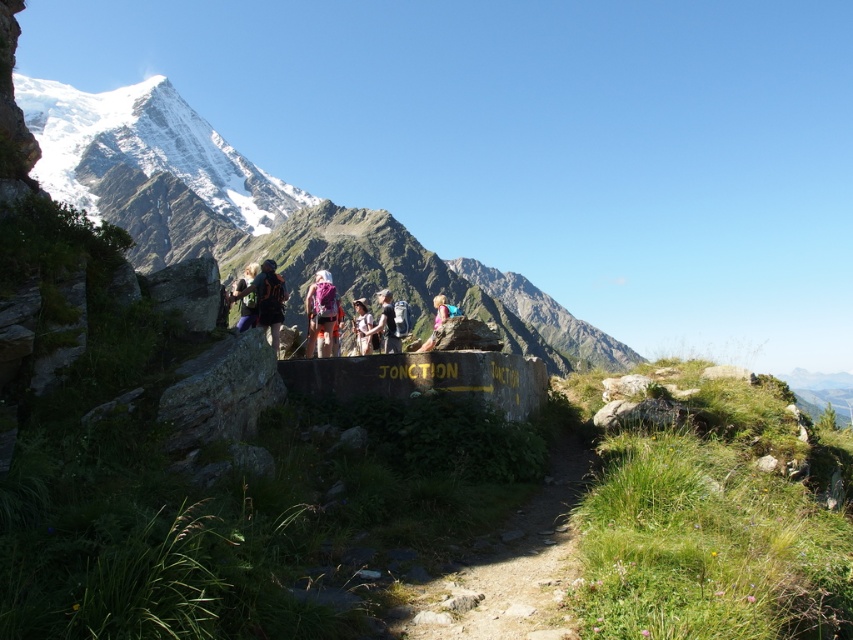
You are a hiker standing at the stone marker and looking towards the snowy granite mountain at upper left and the matte black backpack at center. Which object appears taller from your current position?

The snowy granite mountain at upper left appears taller than the matte black backpack at center because it is much taller as described.

You are a hiker standing at the stone marker and want to take a photo of both the snowy granite mountain at upper left and the matte black backpack at center. Which object should you adjust your camera angle to focus on first to ensure both are in frame?

The snowy granite mountain at upper left is positioned on the left side of the matte black backpack at center, so you should focus on the snowy granite mountain at upper left first to ensure both are captured in the frame.